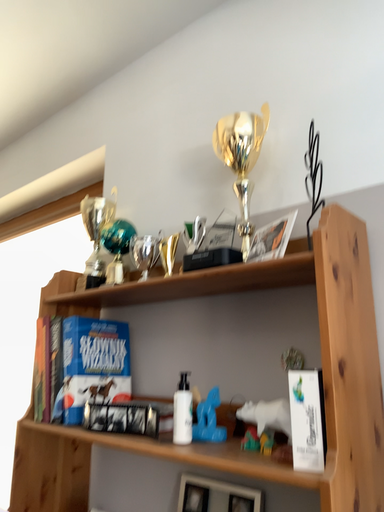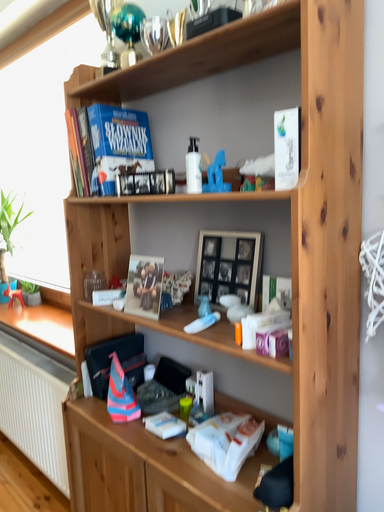
Question: How did the camera likely rotate when shooting the video?

Choices:
 (A) rotated upward
 (B) rotated downward

Answer: (B)